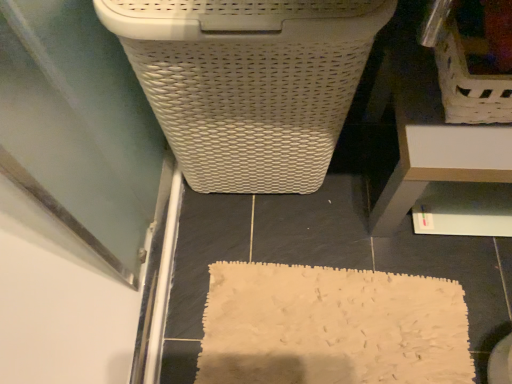
Identify the location of white woven laundry basket at upper center. (249, 82).

What is the approximate height of transparent glass screen door at lower left?

7.96 centimeters.

The image size is (512, 384). In order to click on transparent glass screen door at lower left in this screenshot , I will do (x=82, y=129).

Find the location of a particular element. white woven laundry basket at upper center is located at coordinates (249, 82).

Could you measure the distance between white wicker laundry basket at upper right and transparent glass screen door at lower left?

white wicker laundry basket at upper right is 24.27 inches away from transparent glass screen door at lower left.

From the image's perspective, which object appears higher, white wicker laundry basket at upper right or transparent glass screen door at lower left?

From the image's view, white wicker laundry basket at upper right is above.

Looking at their sizes, would you say white wicker laundry basket at upper right is wider or thinner than transparent glass screen door at lower left?

In the image, white wicker laundry basket at upper right appears to be more narrow than transparent glass screen door at lower left.

From the image's perspective, is white plastic drawer at lower right beneath transparent glass screen door at lower left?

No, from the image's perspective, white plastic drawer at lower right is not beneath transparent glass screen door at lower left.

Are white plastic drawer at lower right and transparent glass screen door at lower left far apart?

white plastic drawer at lower right is near transparent glass screen door at lower left, not far away.

Looking at this image, is white plastic drawer at lower right surrounding transparent glass screen door at lower left?

No, transparent glass screen door at lower left is not inside white plastic drawer at lower right.

Between point (429, 31) and point (495, 200), which one is positioned behind?

Positioned behind is point (495, 200).

From the image's perspective, which is above, white wicker laundry basket at upper right or white plastic drawer at lower right?

From the image's view, white wicker laundry basket at upper right is above.

Would you say white plastic drawer at lower right is part of white wicker laundry basket at upper right's contents?

Definitely not — white plastic drawer at lower right is not inside white wicker laundry basket at upper right.

From a real-world perspective, is white wicker laundry basket at upper right on top of white plastic drawer at lower right?

Correct, in the physical world, white wicker laundry basket at upper right is higher than white plastic drawer at lower right.

Between white plastic drawer at lower right and white woven laundry basket at upper center, which one appears on the left side from the viewer's perspective?

white woven laundry basket at upper center.

From the image's perspective, is white plastic drawer at lower right below white woven laundry basket at upper center?

Correct, white plastic drawer at lower right appears lower than white woven laundry basket at upper center in the image.

Is white wicker laundry basket at upper right next to white woven laundry basket at upper center and touching it?

No, white wicker laundry basket at upper right is not in contact with white woven laundry basket at upper center.

Which object is further away from the camera, white wicker laundry basket at upper right or white woven laundry basket at upper center?

white wicker laundry basket at upper right.

Is white wicker laundry basket at upper right wider or thinner than white woven laundry basket at upper center?

white wicker laundry basket at upper right is thinner than white woven laundry basket at upper center.

From a real-world perspective, is white wicker laundry basket at upper right located higher than white woven laundry basket at upper center?

Yes, from a real-world perspective, white wicker laundry basket at upper right is above white woven laundry basket at upper center.

From a real-world perspective, is white woven laundry basket at upper center positioned over white wicker laundry basket at upper right based on gravity?

Actually, white woven laundry basket at upper center is physically below white wicker laundry basket at upper right in the real world.

Which point is more distant from viewer, (340,98) or (460,24)?

The point (460,24) is farther.

At what (x,y) coordinates should I click in order to perform the action: click on waste container below the white wicker laundry basket at upper right (from a real-world perspective). Please return your answer as a coordinate pair (x, y). Image resolution: width=512 pixels, height=384 pixels. Looking at the image, I should click on (249, 82).

Can you confirm if white woven laundry basket at upper center is thinner than white wicker laundry basket at upper right?

No.

How far apart are transparent glass screen door at lower left and white plastic drawer at lower right?

transparent glass screen door at lower left is 23.21 inches away from white plastic drawer at lower right.

Are transparent glass screen door at lower left and white plastic drawer at lower right located far from each other?

No, transparent glass screen door at lower left is not far from white plastic drawer at lower right.

From a real-world perspective, between transparent glass screen door at lower left and white plastic drawer at lower right, who is vertically lower?

transparent glass screen door at lower left is physically lower.

At what (x,y) coordinates should I click in order to perform the action: click on furniture above the transparent glass screen door at lower left (from the image's perspective). Please return your answer as a coordinate pair (x, y). The width and height of the screenshot is (512, 384). Looking at the image, I should click on (446, 132).

You are a GUI agent. You are given a task and a screenshot of the screen. Output one action in this format:
    pyautogui.click(x=<x>, y=<y>)
    Task: Click on the laundry basket located on the right of transparent glass screen door at lower left
    The image size is (512, 384).
    Given the screenshot: What is the action you would take?
    pyautogui.click(x=471, y=58)

Where is `screen door that is below the white plastic drawer at lower right (from the image's perspective)`? This screenshot has width=512, height=384. screen door that is below the white plastic drawer at lower right (from the image's perspective) is located at coordinates [82, 129].

Estimate the real-world distances between objects in this image. Which object is closer to transparent glass screen door at lower left, white plastic drawer at lower right or white woven laundry basket at upper center?

white woven laundry basket at upper center is closer to transparent glass screen door at lower left.

Based on their spatial positions, is white plastic drawer at lower right or transparent glass screen door at lower left further from white wicker laundry basket at upper right?

Based on the image, transparent glass screen door at lower left appears to be further to white wicker laundry basket at upper right.

Looking at the image, which one is located closer to white woven laundry basket at upper center, white plastic drawer at lower right or transparent glass screen door at lower left?

Among the two, transparent glass screen door at lower left is located nearer to white woven laundry basket at upper center.

From the image, which object appears to be nearer to white woven laundry basket at upper center, transparent glass screen door at lower left or white plastic drawer at lower right?

transparent glass screen door at lower left lies closer to white woven laundry basket at upper center than the other object.

From the image, which object appears to be farther from white wicker laundry basket at upper right, white plastic drawer at lower right or white woven laundry basket at upper center?

Among the two, white woven laundry basket at upper center is located further to white wicker laundry basket at upper right.

Considering their positions, is transparent glass screen door at lower left positioned further to white plastic drawer at lower right than white wicker laundry basket at upper right?

transparent glass screen door at lower left is further to white plastic drawer at lower right.

Which object lies nearer to the anchor point white plastic drawer at lower right, transparent glass screen door at lower left or white woven laundry basket at upper center?

white woven laundry basket at upper center lies closer to white plastic drawer at lower right than the other object.

Which object lies nearer to the anchor point transparent glass screen door at lower left, white woven laundry basket at upper center or white wicker laundry basket at upper right?

Based on the image, white woven laundry basket at upper center appears to be nearer to transparent glass screen door at lower left.

This screenshot has width=512, height=384. Identify the location of waste container between transparent glass screen door at lower left and white plastic drawer at lower right from left to right. (249, 82).

Find the location of a particular element. This screenshot has width=512, height=384. waste container between transparent glass screen door at lower left and white wicker laundry basket at upper right in the horizontal direction is located at coordinates (249, 82).

I want to click on laundry basket between white woven laundry basket at upper center and white plastic drawer at lower right, so click(471, 58).

Where is `laundry basket located between transparent glass screen door at lower left and white plastic drawer at lower right in the left-right direction`? Image resolution: width=512 pixels, height=384 pixels. laundry basket located between transparent glass screen door at lower left and white plastic drawer at lower right in the left-right direction is located at coordinates (471, 58).